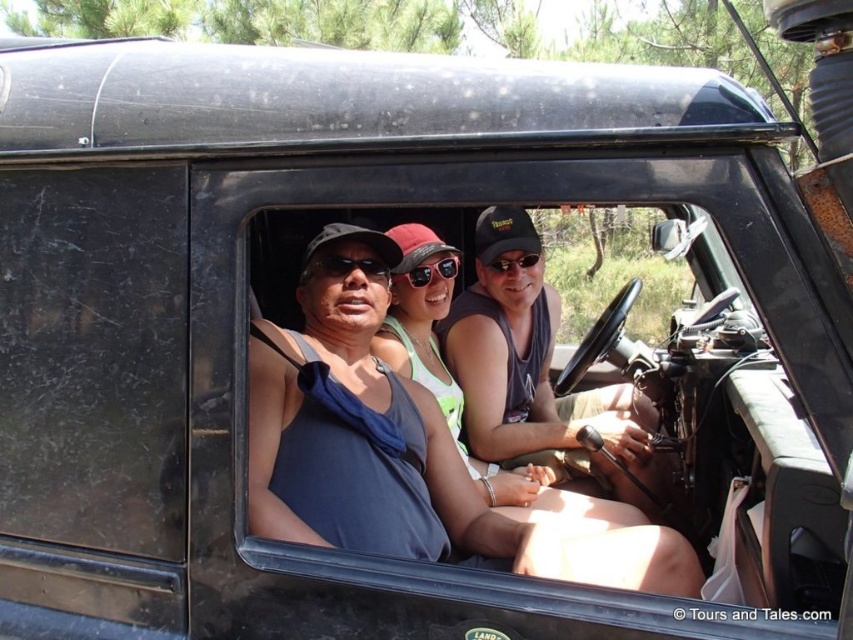
Question: Does matte gray tank top at center have a smaller size compared to black matte sunglasses at center?

Choices:
 (A) yes
 (B) no

Answer: (B)

Question: Which of the following is the farthest from the observer?

Choices:
 (A) (328, 260)
 (B) (422, 266)

Answer: (B)

Question: In this image, where is matte black tank top at center located relative to black matte sunglasses at center?

Choices:
 (A) above
 (B) below

Answer: (B)

Question: Considering the relative positions of matte black tank top at center and black plastic sunglasses at center in the image provided, where is matte black tank top at center located with respect to black plastic sunglasses at center?

Choices:
 (A) above
 (B) below

Answer: (B)

Question: Which point appears farthest from the camera in this image?

Choices:
 (A) (361, 262)
 (B) (438, 266)
 (C) (500, 260)
 (D) (563, 461)

Answer: (C)

Question: Which of these objects is positioned closest to the matte gray tank top at center?

Choices:
 (A) black matte sunglasses at center
 (B) matte black tank top at center

Answer: (A)